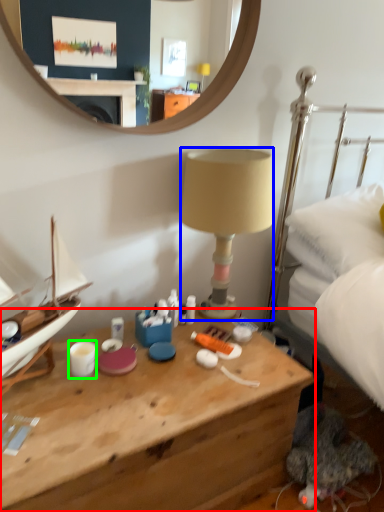
Question: Which is farther away from desk (highlighted by a red box)? lamp (highlighted by a blue box) or coffee cup (highlighted by a green box)?

Choices:
 (A) lamp
 (B) coffee cup

Answer: (A)